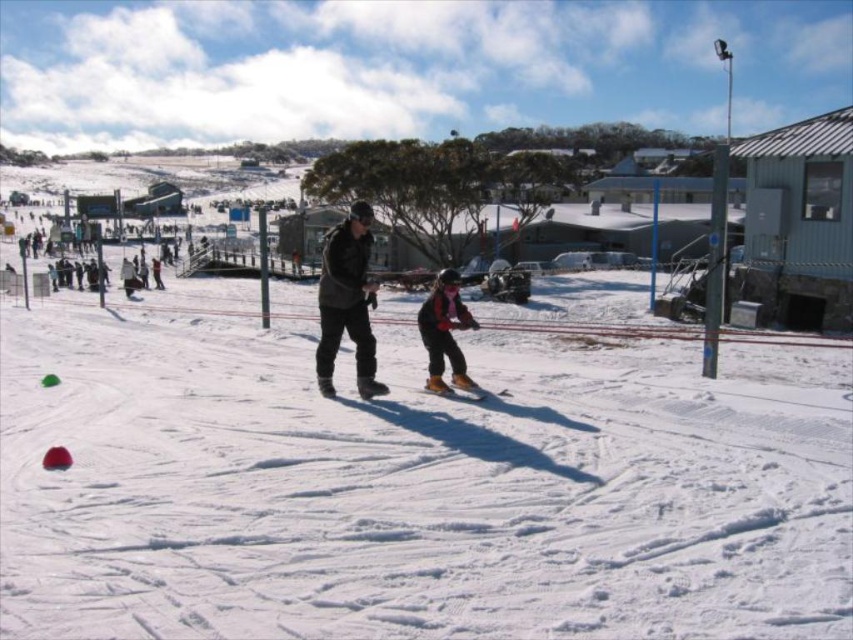
Is white matte snow at center shorter than dark gray jacket at center?

No.

In the scene shown: Between white matte snow at center and dark gray jacket at center, which one appears on the left side from the viewer's perspective?

Positioned to the left is dark gray jacket at center.

Is point (366, 410) behind point (351, 220)?

No, (366, 410) is in front of (351, 220).

Find the location of a particular element. The height and width of the screenshot is (640, 853). white matte snow at center is located at coordinates (413, 476).

Which is behind, point (126, 577) or point (454, 374)?

Point (454, 374)

Measure the distance from white matte snow at center to orange ski boots at center.

The distance of white matte snow at center from orange ski boots at center is 8.90 meters.

Is point (227, 362) positioned before point (437, 346)?

No, it is not.

Locate an element on the screen. Image resolution: width=853 pixels, height=640 pixels. white matte snow at center is located at coordinates (413, 476).

Does dark gray jacket at center have a lesser height compared to shiny orange ski at center?

Incorrect, dark gray jacket at center's height does not fall short of shiny orange ski at center's.

Between point (363, 346) and point (456, 394), which one is positioned behind?

Point (456, 394)

Locate an element on the screen. The image size is (853, 640). dark gray jacket at center is located at coordinates (347, 301).